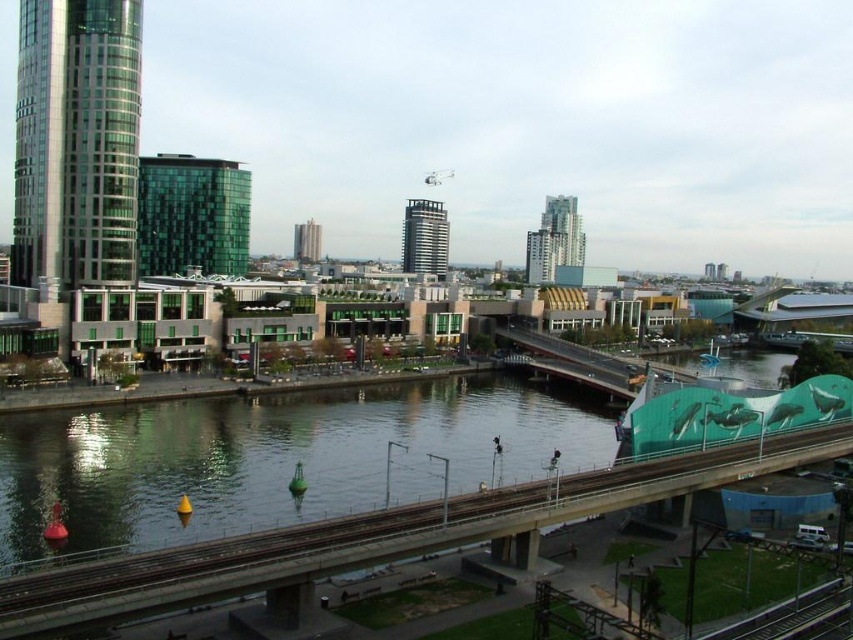
You are a drone operator tasked with delivering a package to a green glass building at upper left. The delivery zone is marked by a point at coordinates (192, 216). Can you confirm if the point is correctly placed on the green glass building at upper left?

Yes, the point at coordinates (192, 216) is correctly placed on the green glass building at upper left as per the provided information.

You are a city planner analyzing this urban layout. You need to determine the exact coordinates of the glassy concrete skyscraper at center for a new public transit route. What are its coordinates?

The glassy concrete skyscraper at center is located at coordinates point [554,241].